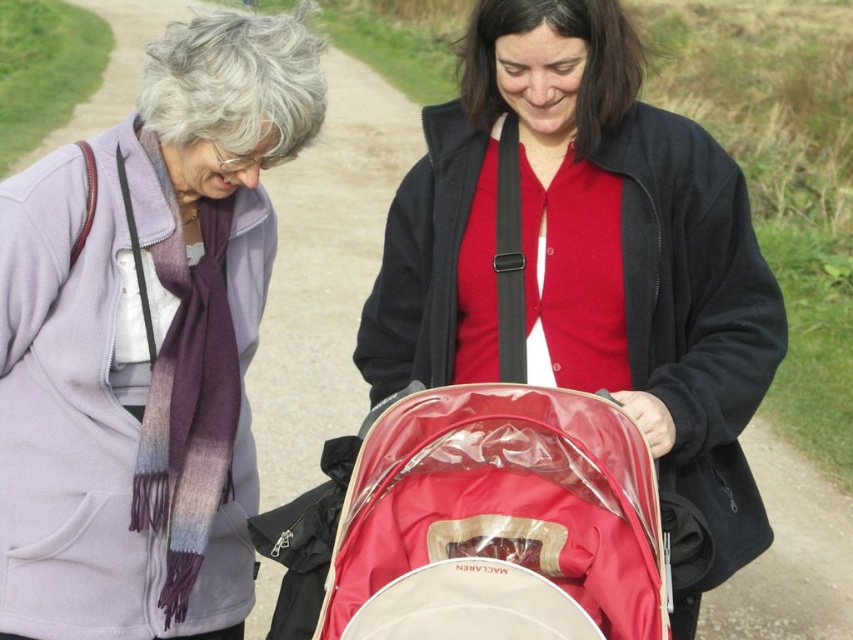
Question: Estimate the real-world distances between objects in this image. Which object is farther from the red fabric baby carriage at center?

Choices:
 (A) matte purple scarf at upper left
 (B) purple wool scarf at left

Answer: (B)

Question: Can you confirm if matte purple scarf at upper left is positioned below red fabric baby carriage at center?

Choices:
 (A) no
 (B) yes

Answer: (A)

Question: Can you confirm if purple wool scarf at left is positioned above red fabric baby carriage at center?

Choices:
 (A) no
 (B) yes

Answer: (B)

Question: Based on their relative distances, which object is nearer to the red fabric baby carriage at center?

Choices:
 (A) matte purple scarf at upper left
 (B) purple wool scarf at left

Answer: (A)

Question: Which object is farther from the camera taking this photo?

Choices:
 (A) matte purple scarf at upper left
 (B) purple wool scarf at left
 (C) red fabric baby carriage at center

Answer: (B)

Question: Does purple wool scarf at left have a greater width compared to matte purple scarf at upper left?

Choices:
 (A) yes
 (B) no

Answer: (B)